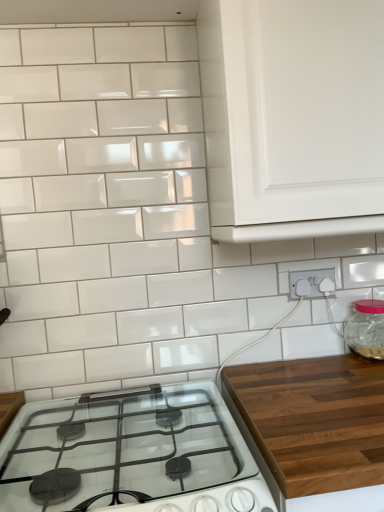
Question: Relative to transparent glass jar at right, is white plastic electrical outlet at lower right in front or behind?

Choices:
 (A) front
 (B) behind

Answer: (B)

Question: Considering the positions of white plastic electrical outlet at lower right and transparent glass jar at right in the image, is white plastic electrical outlet at lower right wider or thinner than transparent glass jar at right?

Choices:
 (A) thin
 (B) wide

Answer: (A)

Question: Which object is positioned farthest from the white glossy gas stove at lower center?

Choices:
 (A) white glossy cabinet at upper right
 (B) transparent glass jar at right
 (C) white plastic electrical outlet at lower right

Answer: (B)

Question: Estimate the real-world distances between objects in this image. Which object is closer to the white glossy cabinet at upper right?

Choices:
 (A) white plastic electrical outlet at lower right
 (B) transparent glass jar at right
 (C) white glossy gas stove at lower center

Answer: (A)